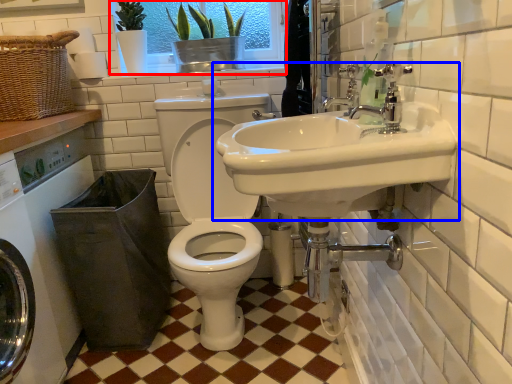
Question: Which point is further to the camera, window screen (highlighted by a red box) or sink (highlighted by a blue box)?

Choices:
 (A) window screen
 (B) sink

Answer: (A)